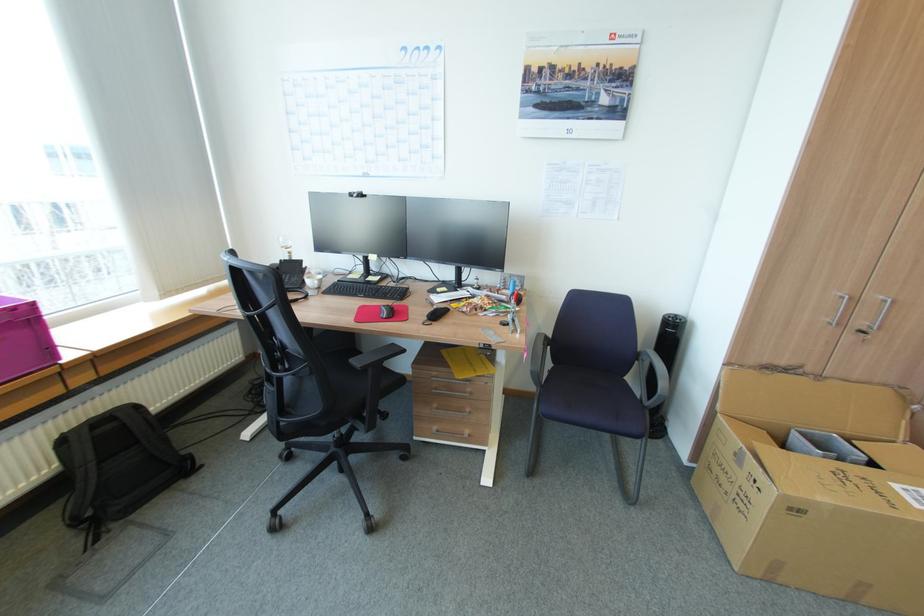
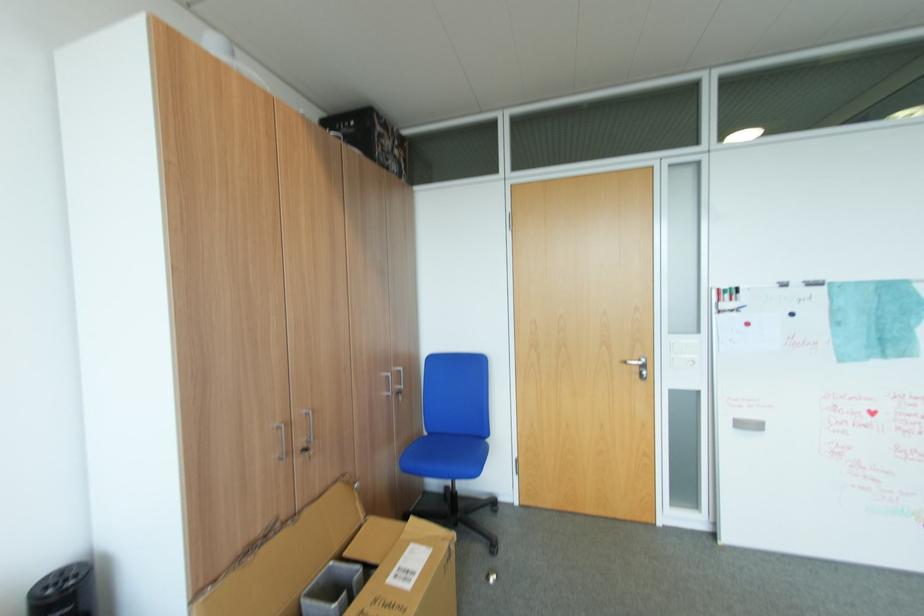
Find the pixel in the second image that matches the point at 868,331 in the first image.

(310, 451)